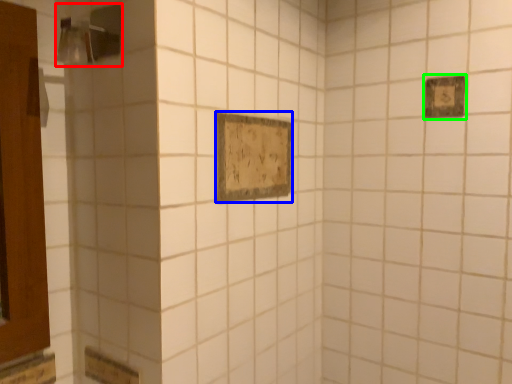
Question: Which object is the farthest from shower (highlighted by a red box)? Choose among these: rectangle (highlighted by a blue box) or rectangle (highlighted by a green box).

Choices:
 (A) rectangle
 (B) rectangle

Answer: (B)